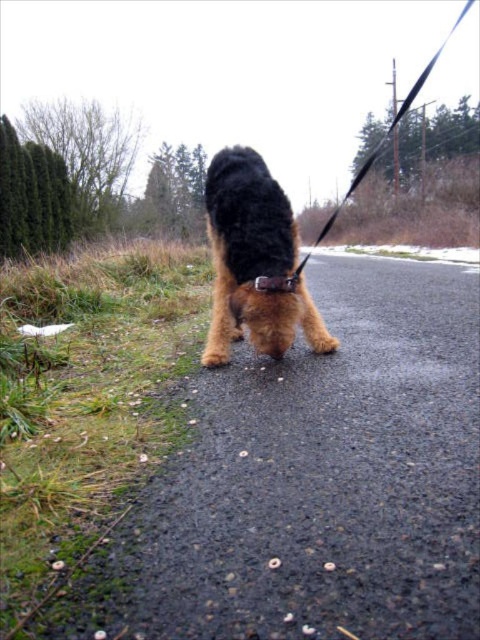
Can you confirm if shaggy brown dog at center is smaller than black leather collar at center?

Incorrect, shaggy brown dog at center is not smaller in size than black leather collar at center.

Does point (273, 220) come closer to viewer compared to point (268, 284)?

No, it is not.

Describe the element at coordinates (253, 260) in the screenshot. The height and width of the screenshot is (640, 480). I see `shaggy brown dog at center` at that location.

Where is `shaggy brown dog at center`? Image resolution: width=480 pixels, height=640 pixels. shaggy brown dog at center is located at coordinates coord(253,260).

Is brown fur dog at center below black leather collar at center?

Yes, brown fur dog at center is below black leather collar at center.

Who is taller, brown fur dog at center or black leather collar at center?

black leather collar at center

The image size is (480, 640). Describe the element at coordinates (324, 477) in the screenshot. I see `brown fur dog at center` at that location.

Identify the location of brown fur dog at center. (324, 477).

Consider the image. Does brown fur dog at center lie behind shaggy brown dog at center?

No, brown fur dog at center is in front of shaggy brown dog at center.

At what (x,y) coordinates should I click in order to perform the action: click on brown fur dog at center. Please return your answer as a coordinate pair (x, y). Looking at the image, I should click on (324, 477).

Identify the location of brown fur dog at center. This screenshot has height=640, width=480. (324, 477).